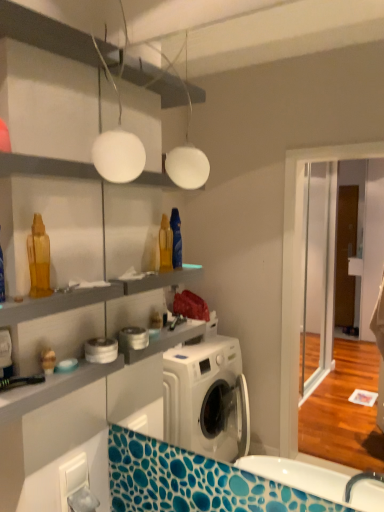
Question: Is white matte globe at upper center inside or outside of white glossy shelf at upper center?

Choices:
 (A) inside
 (B) outside

Answer: (B)

Question: Is point (137, 152) positioned closer to the camera than point (29, 158)?

Choices:
 (A) closer
 (B) farther

Answer: (B)

Question: Which is nearer to the white matte globe at upper center?

Choices:
 (A) white glossy shelf at upper center
 (B) matte plastic toy at lower left

Answer: (A)

Question: Which of these objects is positioned farthest from the matte plastic toy at lower left?

Choices:
 (A) white glossy shelf at upper center
 (B) white matte globe at upper center

Answer: (B)